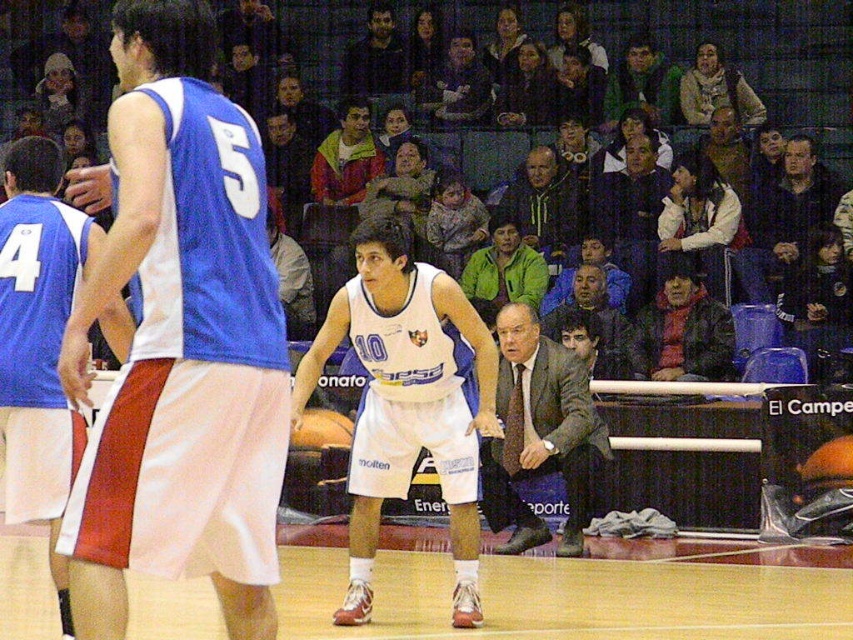
Can you confirm if dark gray suit at center is positioned below dark blue jacket at upper center?

Correct, dark gray suit at center is located below dark blue jacket at upper center.

Does point (592, 440) come farther from viewer compared to point (433, 83)?

No.

Measure the distance between dark gray suit at center and camera.

9.75 meters

Identify the location of dark gray suit at center. (538, 433).

Which is behind, point (567, 314) or point (323, 420)?

The point (567, 314) is more distant.

From the picture: Is dark brown leather jacket at center further to the viewer compared to orange matte basketball at center?

Yes, it is.

Who is more distant from viewer, (607, 371) or (341, 428)?

Positioned behind is point (607, 371).

Identify the location of dark brown leather jacket at center. The height and width of the screenshot is (640, 853). (593, 317).

Who is higher up, white matte basketball jersey at center or dark gray suit at center?

white matte basketball jersey at center is higher up.

Image resolution: width=853 pixels, height=640 pixels. Describe the element at coordinates (410, 396) in the screenshot. I see `white matte basketball jersey at center` at that location.

Identify the location of white matte basketball jersey at center. The height and width of the screenshot is (640, 853). (410, 396).